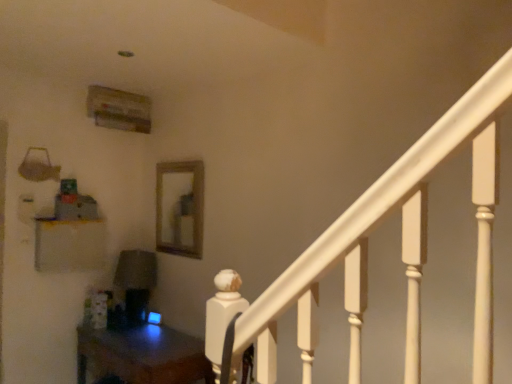
Question: Is matte white shelf at left in front of or behind wooden table at lower left in the image?

Choices:
 (A) front
 (B) behind

Answer: (B)

Question: Choose the correct answer: Is matte white shelf at left inside wooden table at lower left or outside it?

Choices:
 (A) inside
 (B) outside

Answer: (B)

Question: Estimate the real-world distances between objects in this image. Which object is closer to the matte white shelf at left?

Choices:
 (A) wooden table at lower left
 (B) wooden frame mirror at center

Answer: (B)

Question: Based on their relative distances, which object is nearer to the matte white shelf at left?

Choices:
 (A) wooden frame mirror at center
 (B) wooden table at lower left

Answer: (A)